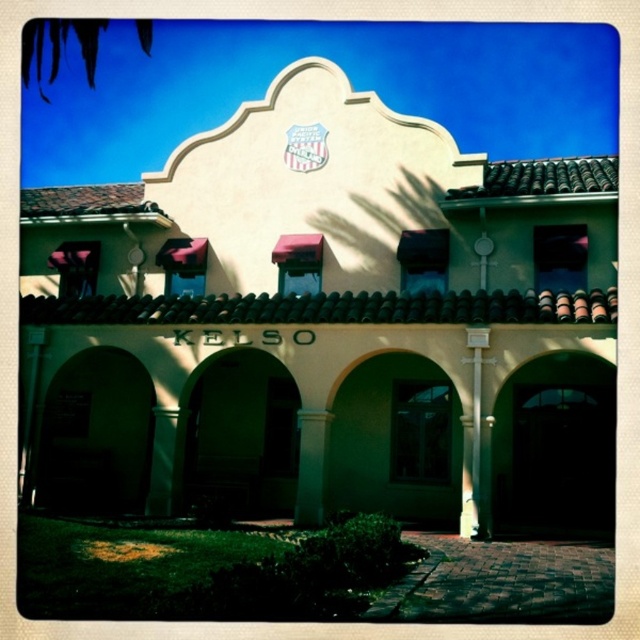
Is point (312, 429) in front of point (164, 442)?

Yes.

Is green stone column at center thinner than green stone pillar at center?

Incorrect, green stone column at center's width is not less than green stone pillar at center's.

Which is in front, point (321, 422) or point (161, 429)?

Point (321, 422)

What are the coordinates of `green stone column at center` in the screenshot? It's located at (310, 465).